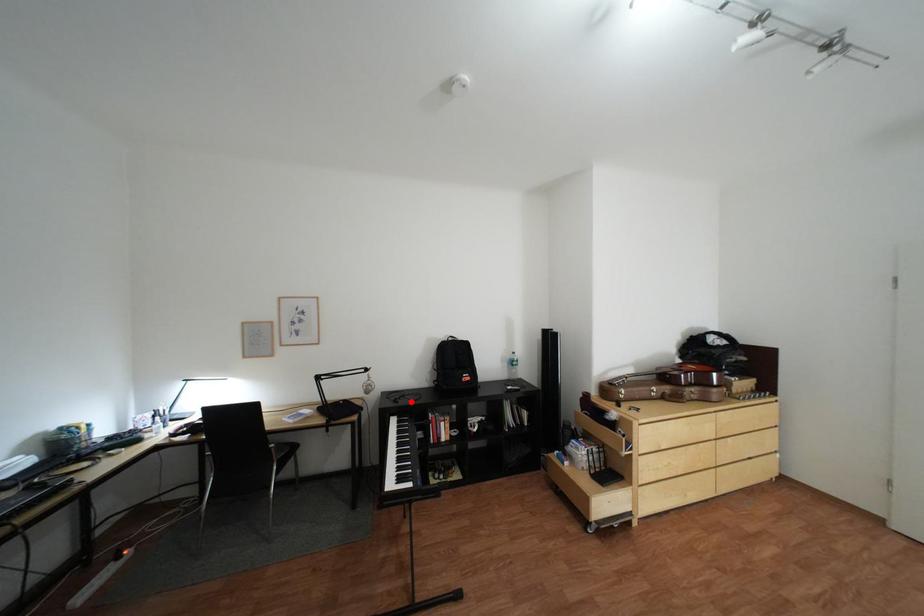
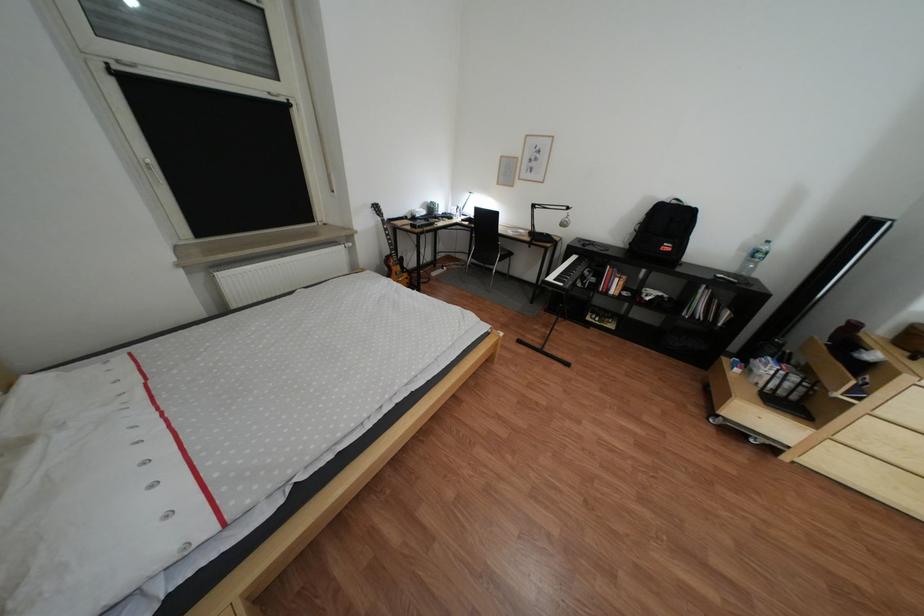
Question: I am providing you with two images of the same scene from different viewpoints. Image1 has a red point marked. In image2, the corresponding 3D location appears at what relative position? Reply with the corresponding letter.

Choices:
 (A) Closer
 (B) Farther

Answer: (A)